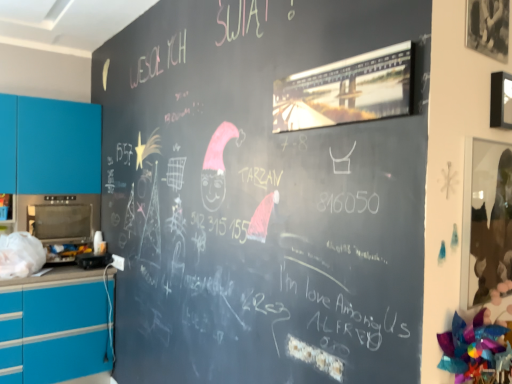
At what (x,y) coordinates should I click in order to perform the action: click on matte blue cabinet at left. Please return your answer as a coordinate pair (x, y). Looking at the image, I should click on (49, 146).

Identify the location of matte blue cabinet at left. tap(49, 146).

In the scene shown: Is matte blue cabinet at left far from metallic oven at left, which is counted as the 1th appliance, starting from the top?

No.

From the image's perspective, is matte blue cabinet at left below metallic oven at left, which is the 2th appliance from bottom to top?

Actually, matte blue cabinet at left appears above metallic oven at left, which is the 2th appliance from bottom to top, in the image.

Can you confirm if matte blue cabinet at left is wider than metallic oven at left, which is the 2th appliance from bottom to top?

Incorrect, the width of matte blue cabinet at left does not surpass that of metallic oven at left, which is the 2th appliance from bottom to top.

Is the position of matte blue cabinet at left more distant than that of metallic oven at left, which is the 2th appliance from bottom to top?

No, it is in front of metallic oven at left, which is the 2th appliance from bottom to top.

Is black plastic toaster at lower left, which appears as the 2th appliance when viewed from the top, inside matte blue cabinet at left?

No, black plastic toaster at lower left, which appears as the 2th appliance when viewed from the top, is located outside of matte blue cabinet at left.

Who is smaller, matte blue cabinet at left or black plastic toaster at lower left, which appears as the 2th appliance when viewed from the top?

black plastic toaster at lower left, which appears as the 2th appliance when viewed from the top.

Is matte blue cabinet at left facing away from black plastic toaster at lower left, the second appliance positioned from the left?

No.

Considering the positions of objects metallic oven at left, which is the 2th appliance from bottom to top, and black plastic toaster at lower left, which appears as the 2th appliance when viewed from the top, in the image provided, who is more to the left, metallic oven at left, which is the 2th appliance from bottom to top, or black plastic toaster at lower left, which appears as the 2th appliance when viewed from the top,?

metallic oven at left, which is the 2th appliance from bottom to top.

From a real-world perspective, is metallic oven at left, which is the 2th appliance from bottom to top, positioned over black plastic toaster at lower left, the second appliance positioned from the left, based on gravity?

Yes.

From the image's perspective, which is below, metallic oven at left, the 2th appliance from the right, or black plastic toaster at lower left, the 1th appliance positioned from the right?

black plastic toaster at lower left, the 1th appliance positioned from the right.

Would you say metallic oven at left, the 1th appliance when ordered from left to right, contains matte blue cabinet at left?

No.

Considering the relative positions of metallic oven at left, the 2th appliance from the right, and matte blue cabinet at left in the image provided, is metallic oven at left, the 2th appliance from the right, to the left of matte blue cabinet at left from the viewer's perspective?

No.

Looking at the image, does metallic oven at left, which is the 2th appliance from bottom to top, seem bigger or smaller compared to matte blue cabinet at left?

Clearly, metallic oven at left, which is the 2th appliance from bottom to top, is smaller in size than matte blue cabinet at left.

From a real-world perspective, which object stands above the other?

matte blue cabinet at left is physically above.

Is black plastic toaster at lower left, the second appliance positioned from the left, aimed at matte blue cabinet at left?

No, black plastic toaster at lower left, the second appliance positioned from the left, is not facing towards matte blue cabinet at left.

Can you confirm if black plastic toaster at lower left, which appears as the 2th appliance when viewed from the top, is wider than matte blue cabinet at left?

Incorrect, the width of black plastic toaster at lower left, which appears as the 2th appliance when viewed from the top, does not surpass that of matte blue cabinet at left.

From the image's perspective, which one is positioned lower, black plastic toaster at lower left, which appears as the 2th appliance when viewed from the top, or matte blue cabinet at left?

black plastic toaster at lower left, which appears as the 2th appliance when viewed from the top, from the image's perspective.

Between black plastic toaster at lower left, the second appliance positioned from the left, and matte blue cabinet at left, which one has smaller size?

Smaller between the two is black plastic toaster at lower left, the second appliance positioned from the left.

Which object is closer to the camera, black plastic toaster at lower left, the second appliance positioned from the left, or metallic oven at left, which is the 2th appliance from bottom to top?

black plastic toaster at lower left, the second appliance positioned from the left.

Looking at this image, which is farther from the camera, [82,255] or [51,205]?

The point [82,255] is more distant.

Is black plastic toaster at lower left, the 1th appliance positioned from the right, oriented away from metallic oven at left, which is counted as the 1th appliance, starting from the top?

No, black plastic toaster at lower left, the 1th appliance positioned from the right,'s orientation is not away from metallic oven at left, which is counted as the 1th appliance, starting from the top.

Is metallic oven at left, the 1th appliance when ordered from left to right, completely or partially inside black plastic toaster at lower left, the first appliance positioned from the bottom?

No, black plastic toaster at lower left, the first appliance positioned from the bottom, does not contain metallic oven at left, the 1th appliance when ordered from left to right.

Image resolution: width=512 pixels, height=384 pixels. In order to click on the 1st appliance counting from the right side of the matte blue cabinet at left in this screenshot , I will do `click(60, 221)`.

You are a GUI agent. You are given a task and a screenshot of the screen. Output one action in this format:
    pyautogui.click(x=<x>, y=<y>)
    Task: Click on the cabinetry located behind the black plastic toaster at lower left, the 1th appliance positioned from the right
    The image size is (512, 384).
    Given the screenshot: What is the action you would take?
    pyautogui.click(x=49, y=146)

Estimate the real-world distances between objects in this image. Which object is further from matte blue cabinet at left, metallic oven at left, the 1th appliance when ordered from left to right, or black plastic toaster at lower left, the 1th appliance positioned from the right?

black plastic toaster at lower left, the 1th appliance positioned from the right, lies further to matte blue cabinet at left than the other object.

From the image, which object appears to be nearer to metallic oven at left, which is the 2th appliance from bottom to top, matte blue cabinet at left or black plastic toaster at lower left, which appears as the 2th appliance when viewed from the top?

matte blue cabinet at left is positioned closer to the anchor metallic oven at left, which is the 2th appliance from bottom to top.

Estimate the real-world distances between objects in this image. Which object is closer to black plastic toaster at lower left, the second appliance positioned from the left, metallic oven at left, which is the 2th appliance from bottom to top, or matte blue cabinet at left?

metallic oven at left, which is the 2th appliance from bottom to top, is closer to black plastic toaster at lower left, the second appliance positioned from the left.

When comparing their distances from metallic oven at left, which is the 2th appliance from bottom to top, does black plastic toaster at lower left, the 1th appliance positioned from the right, or matte blue cabinet at left seem further?

black plastic toaster at lower left, the 1th appliance positioned from the right, lies further to metallic oven at left, which is the 2th appliance from bottom to top, than the other object.

When comparing their distances from matte blue cabinet at left, does black plastic toaster at lower left, the second appliance positioned from the left, or metallic oven at left, which is the 2th appliance from bottom to top, seem further?

black plastic toaster at lower left, the second appliance positioned from the left, lies further to matte blue cabinet at left than the other object.

From the image, which object appears to be nearer to black plastic toaster at lower left, the first appliance positioned from the bottom, matte blue cabinet at left or metallic oven at left, which is the 2th appliance from bottom to top?

The object closer to black plastic toaster at lower left, the first appliance positioned from the bottom, is metallic oven at left, which is the 2th appliance from bottom to top.

Image resolution: width=512 pixels, height=384 pixels. Identify the location of appliance between matte blue cabinet at left and black plastic toaster at lower left, the second appliance positioned from the left, in the vertical direction. (60, 221).